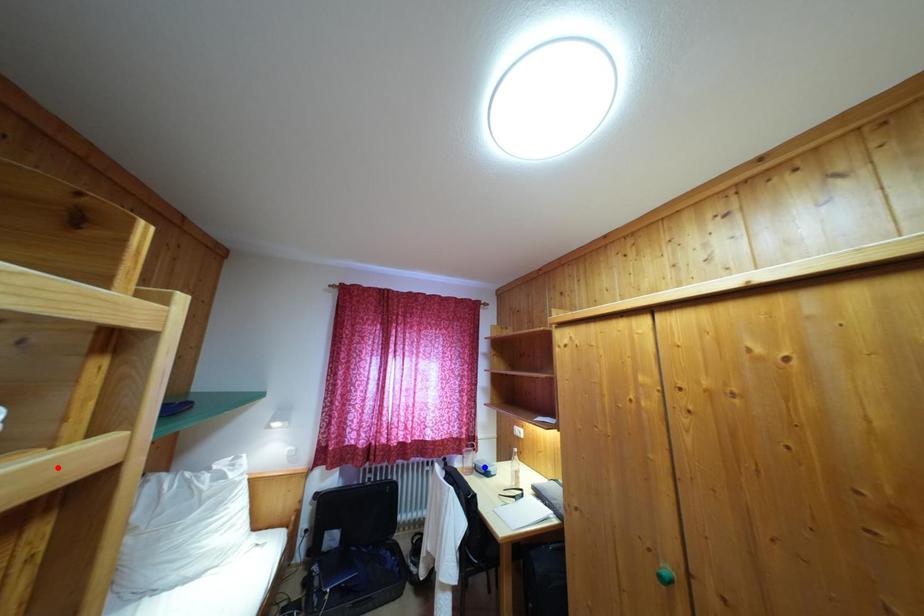
Question: Which of the two points in the image is closer to the camera?

Choices:
 (A) Blue point is closer.
 (B) Red point is closer.

Answer: (B)